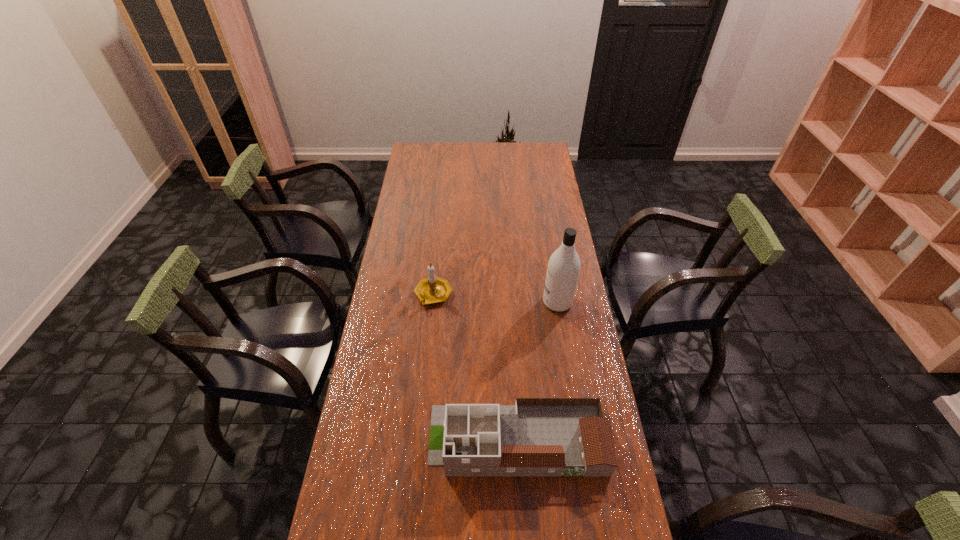
Locate an element on the screen. shampoo is located at coordinates (563, 269).

The image size is (960, 540). Find the location of `candle holder`. candle holder is located at coordinates (431, 290).

Where is `dollhouse`? The height and width of the screenshot is (540, 960). dollhouse is located at coordinates (537, 436).

Identify the location of free region located 0.190m on the front-facing side of the tallest object. (492, 302).

The image size is (960, 540). Find the location of `blank space located 0.230m on the front-facing side of the tallest object`. blank space located 0.230m on the front-facing side of the tallest object is located at coordinates (481, 302).

At what (x,y) coordinates should I click in order to perform the action: click on free point located 0.170m on the front-facing side of the tallest object. Please return your answer as a coordinate pair (x, y). Looking at the image, I should click on (497, 302).

You are a GUI agent. You are given a task and a screenshot of the screen. Output one action in this format:
    pyautogui.click(x=<x>, y=<y>)
    Task: Click on the vacant space located 0.050m on the back of the candle holder
    The height and width of the screenshot is (540, 960).
    Given the screenshot: What is the action you would take?
    pyautogui.click(x=436, y=271)

The height and width of the screenshot is (540, 960). What are the coordinates of `free location located at the main entrance of the dollhouse` in the screenshot? It's located at (398, 440).

Locate an element on the screen. free space located 0.160m at the main entrance of the dollhouse is located at coordinates (374, 440).

Identify the location of blank space located 0.160m at the main entrance of the dollhouse. Image resolution: width=960 pixels, height=540 pixels. (374, 440).